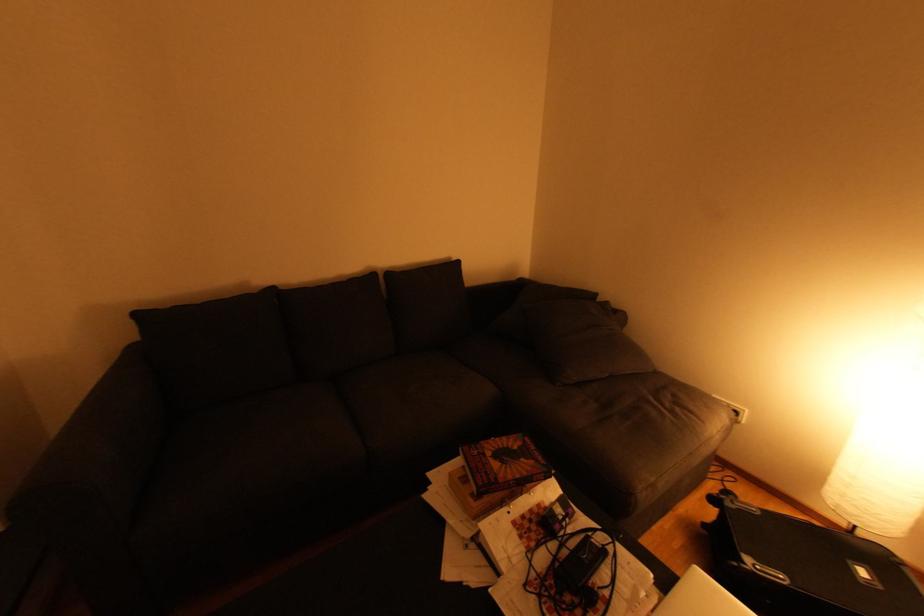
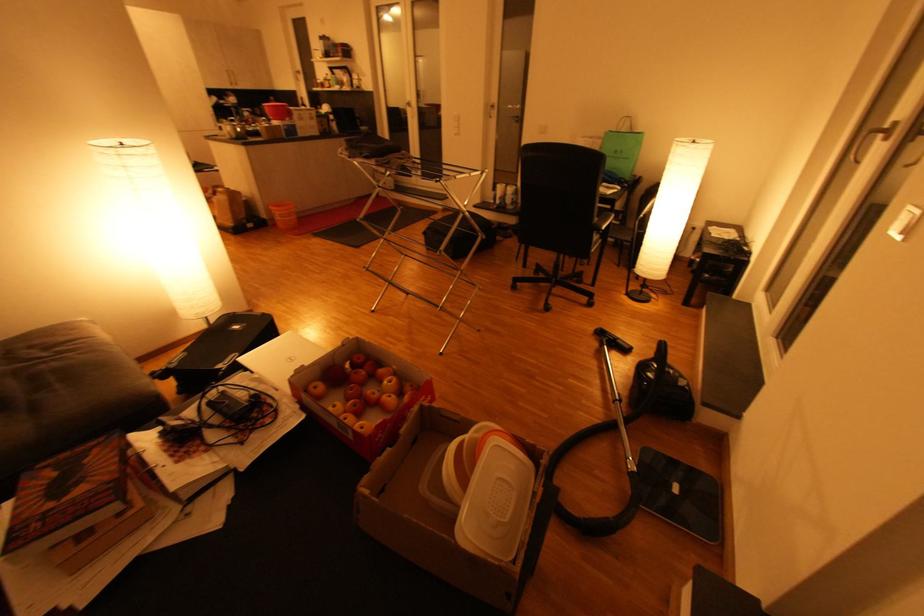
In the second image, find the point that corresponds to pixel 672 405 in the first image.

(47, 355)